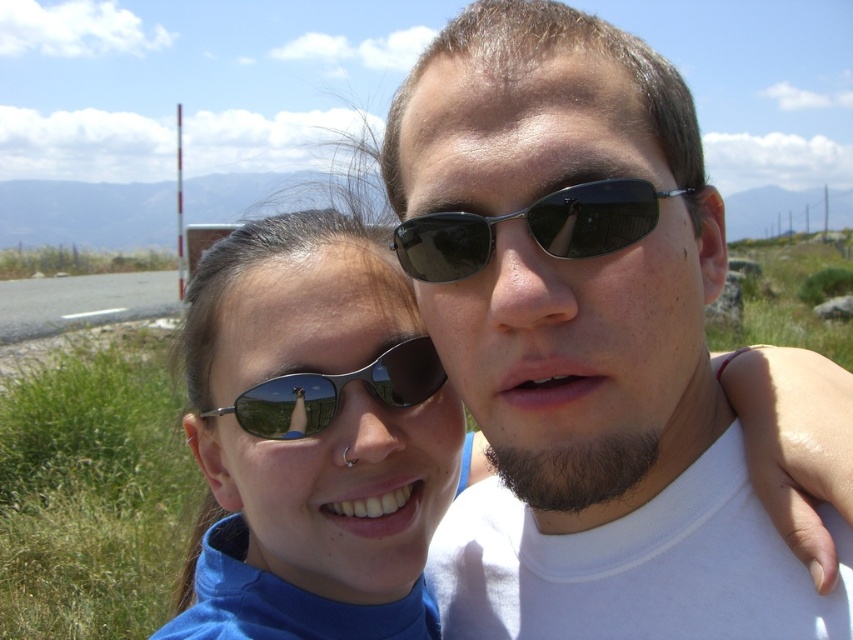
Is point (486, 339) positioned in front of point (318, 384)?

That is True.

Is matte black sunglasses at center smaller than matte black sunglasses at left?

No, matte black sunglasses at center is not smaller than matte black sunglasses at left.

This screenshot has width=853, height=640. I want to click on matte black sunglasses at center, so click(584, 348).

Based on the photo, which is below, matte black sunglasses at center or metallic reflective sunglasses at center?

Positioned lower is metallic reflective sunglasses at center.

Is matte black sunglasses at center smaller than metallic reflective sunglasses at center?

Actually, matte black sunglasses at center might be larger than metallic reflective sunglasses at center.

Where is `matte black sunglasses at center`? The width and height of the screenshot is (853, 640). matte black sunglasses at center is located at coordinates (584, 348).

Does black plastic sunglasses at center lie in front of metallic reflective sunglasses at center?

Yes, black plastic sunglasses at center is in front of metallic reflective sunglasses at center.

This screenshot has width=853, height=640. What do you see at coordinates (532, 228) in the screenshot? I see `black plastic sunglasses at center` at bounding box center [532, 228].

What are the coordinates of `black plastic sunglasses at center` in the screenshot? It's located at (532, 228).